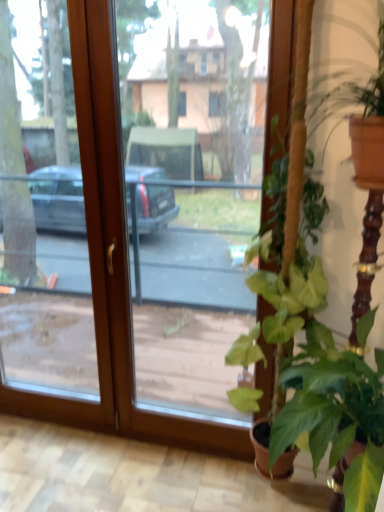
Question: Considering the positions of green leafy plant at lower right, marked as the third houseplant in a top-to-bottom arrangement, and transparent glass door at center in the image, is green leafy plant at lower right, marked as the third houseplant in a top-to-bottom arrangement, bigger or smaller than transparent glass door at center?

Choices:
 (A) big
 (B) small

Answer: (B)

Question: Visually, is green leafy plant at lower right, which is the first houseplant in bottom-to-top order, positioned to the left or to the right of transparent glass door at center?

Choices:
 (A) left
 (B) right

Answer: (B)

Question: Considering the real-world distances, which object is farthest from the green leafy plant at right, acting as the first houseplant starting from the top?

Choices:
 (A) green matte plant at right, arranged as the second houseplant when ordered from the bottom
 (B) transparent glass door at center
 (C) green leafy plant at lower right, which is the first houseplant in bottom-to-top order

Answer: (B)

Question: Estimate the real-world distances between objects in this image. Which object is closer to the transparent glass door at center?

Choices:
 (A) green matte plant at right, arranged as the second houseplant when ordered from the bottom
 (B) green leafy plant at right, which is the 3th houseplant from bottom to top
 (C) green leafy plant at lower right, which is the first houseplant in bottom-to-top order

Answer: (A)